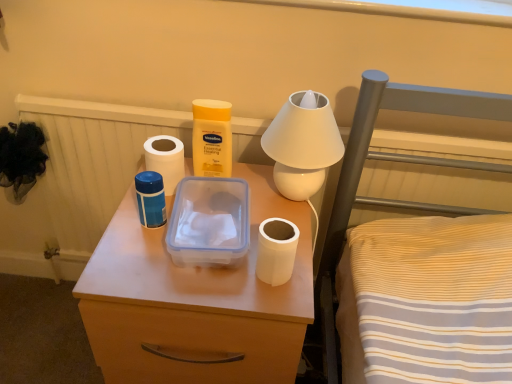
Question: Is matte plastic container at center far from white matte toilet paper at center, the second toilet paper viewed from the back?

Choices:
 (A) no
 (B) yes

Answer: (A)

Question: Is white matte toilet paper at center, placed as the second toilet paper when sorted from left to right, a part of matte plastic container at center?

Choices:
 (A) no
 (B) yes

Answer: (A)

Question: Considering the relative positions of matte plastic container at center and white matte toilet paper at center, the second toilet paper viewed from the back, in the image provided, is matte plastic container at center to the left of white matte toilet paper at center, the second toilet paper viewed from the back, from the viewer's perspective?

Choices:
 (A) yes
 (B) no

Answer: (A)

Question: Does matte plastic container at center have a greater height compared to white matte toilet paper at center, which appears as the 1th toilet paper when viewed from the front?

Choices:
 (A) no
 (B) yes

Answer: (B)

Question: Considering the relative positions of matte plastic container at center and white matte toilet paper at center, which is the second toilet paper from top to bottom, in the image provided, is matte plastic container at center to the right of white matte toilet paper at center, which is the second toilet paper from top to bottom, from the viewer's perspective?

Choices:
 (A) no
 (B) yes

Answer: (A)

Question: Considering the positions of matte plastic container at center and white glossy table lamp at upper center in the image, is matte plastic container at center taller or shorter than white glossy table lamp at upper center?

Choices:
 (A) tall
 (B) short

Answer: (A)

Question: Considering the positions of point (209, 334) and point (295, 185), is point (209, 334) closer or farther from the camera than point (295, 185)?

Choices:
 (A) farther
 (B) closer

Answer: (B)

Question: In the image, is matte plastic container at center on the left side or the right side of white glossy table lamp at upper center?

Choices:
 (A) right
 (B) left

Answer: (B)

Question: From the image's perspective, relative to white glossy table lamp at upper center, is matte plastic container at center above or below?

Choices:
 (A) below
 (B) above

Answer: (A)

Question: From the image's perspective, is white glossy table lamp at upper center positioned above or below white matte toilet paper at center, placed as the second toilet paper when sorted from left to right?

Choices:
 (A) above
 (B) below

Answer: (A)

Question: Is white glossy table lamp at upper center bigger or smaller than white matte toilet paper at center, which is the 1th toilet paper in bottom-to-top order?

Choices:
 (A) big
 (B) small

Answer: (A)

Question: Based on their positions, is white glossy table lamp at upper center located to the left or right of white matte toilet paper at center, which is the 1th toilet paper in bottom-to-top order?

Choices:
 (A) right
 (B) left

Answer: (A)

Question: Would you say white glossy table lamp at upper center is inside or outside white matte toilet paper at center, which is the 1th toilet paper in bottom-to-top order?

Choices:
 (A) inside
 (B) outside

Answer: (B)

Question: From a real-world perspective, is matte plastic container at center above or below transparent plastic lunch box at center?

Choices:
 (A) below
 (B) above

Answer: (A)

Question: In terms of width, does matte plastic container at center look wider or thinner when compared to transparent plastic lunch box at center?

Choices:
 (A) thin
 (B) wide

Answer: (B)